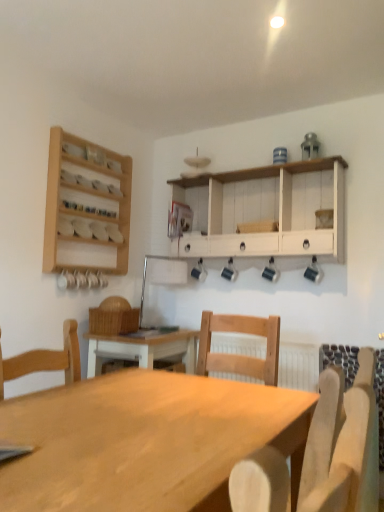
Question: Is light wood table at center a part of light wood chair at center?

Choices:
 (A) no
 (B) yes

Answer: (A)

Question: From the image's perspective, does light wood chair at center appear higher than light wood table at center?

Choices:
 (A) no
 (B) yes

Answer: (B)

Question: Is light wood chair at center with light wood table at center?

Choices:
 (A) yes
 (B) no

Answer: (B)

Question: Does light wood chair at center lie behind light wood table at center?

Choices:
 (A) no
 (B) yes

Answer: (B)

Question: Is light wood chair at center facing away from light wood table at center?

Choices:
 (A) yes
 (B) no

Answer: (B)

Question: Is white wood cabinet at upper center wider or thinner than light wood table at center?

Choices:
 (A) thin
 (B) wide

Answer: (A)

Question: Considering the relative positions of white wood cabinet at upper center and light wood table at center in the image provided, is white wood cabinet at upper center to the left or to the right of light wood table at center?

Choices:
 (A) right
 (B) left

Answer: (A)

Question: From the image's perspective, relative to light wood table at center, is white wood cabinet at upper center above or below?

Choices:
 (A) above
 (B) below

Answer: (A)

Question: Is white wood cabinet at upper center taller or shorter than light wood table at center?

Choices:
 (A) tall
 (B) short

Answer: (B)

Question: From a real-world perspective, is white wood cabinet at upper center positioned above or below wooden spice rack at upper left?

Choices:
 (A) below
 (B) above

Answer: (A)

Question: Is white wood cabinet at upper center in front of or behind wooden spice rack at upper left in the image?

Choices:
 (A) behind
 (B) front

Answer: (B)

Question: Is white wood cabinet at upper center taller or shorter than wooden spice rack at upper left?

Choices:
 (A) short
 (B) tall

Answer: (A)

Question: Is white wood cabinet at upper center situated inside wooden spice rack at upper left or outside?

Choices:
 (A) outside
 (B) inside

Answer: (A)

Question: From the image's perspective, is wooden spice rack at upper left above or below white wood cabinet at upper center?

Choices:
 (A) above
 (B) below

Answer: (A)

Question: In the image, is wooden spice rack at upper left positioned in front of or behind white wood cabinet at upper center?

Choices:
 (A) behind
 (B) front

Answer: (A)